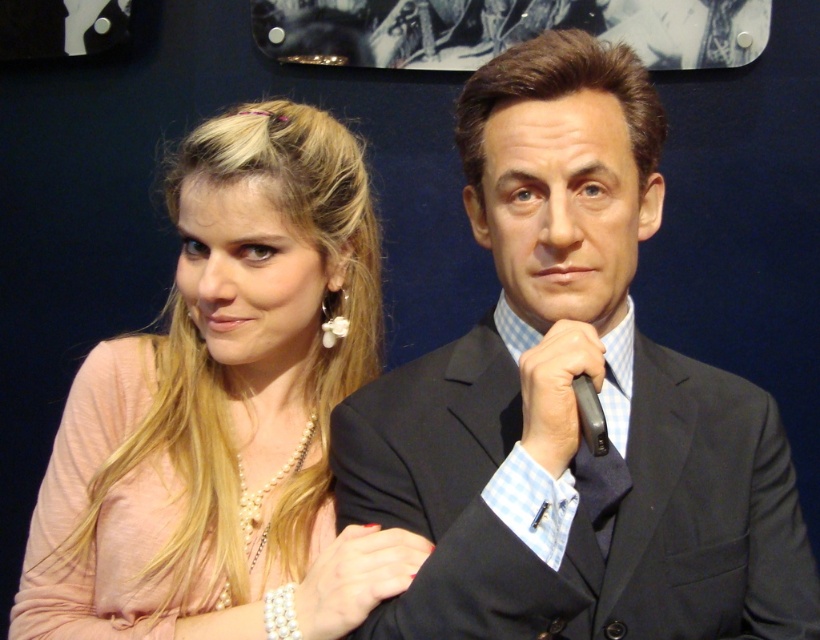
Can you confirm if smooth black suit at center is positioned above dark blue textured tie at center?

Yes, smooth black suit at center is above dark blue textured tie at center.

Between point (577, 618) and point (627, 323), which one is positioned in front?

Positioned in front is point (577, 618).

Between point (709, 568) and point (616, 442), which one is positioned behind?

Positioned behind is point (616, 442).

I want to click on smooth black suit at center, so click(x=572, y=403).

Which is above, smooth black suit at center or pearl necklace at center?

smooth black suit at center is higher up.

Can you confirm if smooth black suit at center is taller than pearl necklace at center?

Incorrect, smooth black suit at center's height is not larger of pearl necklace at center's.

Find the location of a particular element. The image size is (820, 640). smooth black suit at center is located at coordinates (572, 403).

What are the coordinates of `smooth black suit at center` in the screenshot? It's located at (572, 403).

How much distance is there between pearl necklace at center and dark blue textured tie at center?

pearl necklace at center and dark blue textured tie at center are 11.21 inches apart from each other.

Does pearl necklace at center appear under dark blue textured tie at center?

Yes, pearl necklace at center is below dark blue textured tie at center.

Is point (190, 600) less distant than point (563, 529)?

No.

The width and height of the screenshot is (820, 640). In order to click on pearl necklace at center in this screenshot , I will do `click(226, 412)`.